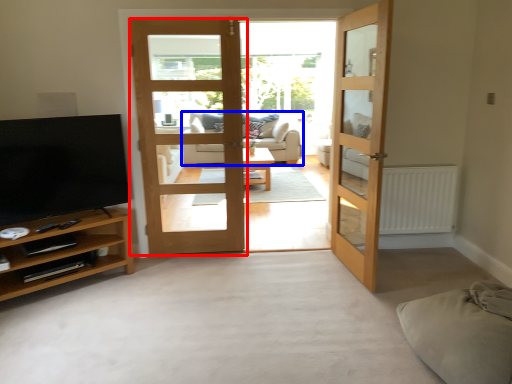
Question: Among these objects, which one is farthest to the camera, door (highlighted by a red box) or studio couch (highlighted by a blue box)?

Choices:
 (A) door
 (B) studio couch

Answer: (B)